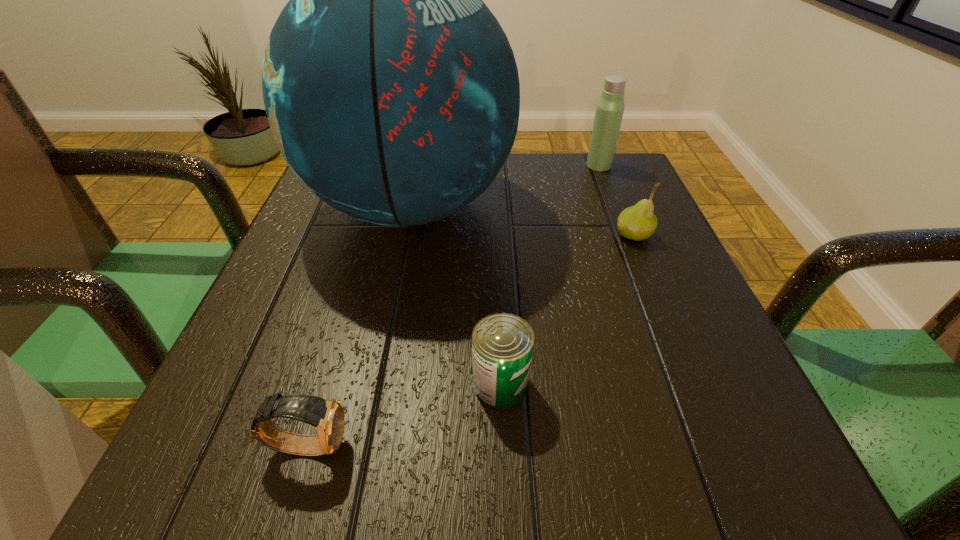
At what (x,y) coordinates should I click in order to perform the action: click on free space at the far edge. Please return your answer as a coordinate pair (x, y). The image size is (960, 540). Looking at the image, I should click on (545, 202).

At what (x,y) coordinates should I click in order to perform the action: click on free spot at the left edge of the desktop. Please return your answer as a coordinate pair (x, y). The height and width of the screenshot is (540, 960). Looking at the image, I should click on (325, 266).

Locate an element on the screen. Image resolution: width=960 pixels, height=540 pixels. vacant space at the right edge of the desktop is located at coordinates (626, 238).

In the image, there is a desktop. Identify the location of vacant space at the near left corner. The height and width of the screenshot is (540, 960). (186, 436).

In the image, there is a desktop. Identify the location of free space at the far right corner. This screenshot has height=540, width=960. (618, 207).

Identify the location of vacant area that lies between the pear and the second tallest object. (616, 200).

This screenshot has width=960, height=540. I want to click on vacant area that lies between the pear and the tallest object, so click(x=522, y=221).

This screenshot has height=540, width=960. In order to click on empty space that is in between the pear and the globe in this screenshot , I will do `click(522, 221)`.

This screenshot has height=540, width=960. Find the location of `free area in between the watch and the globe`. free area in between the watch and the globe is located at coordinates (359, 326).

I want to click on unoccupied area between the pear and the can, so click(567, 309).